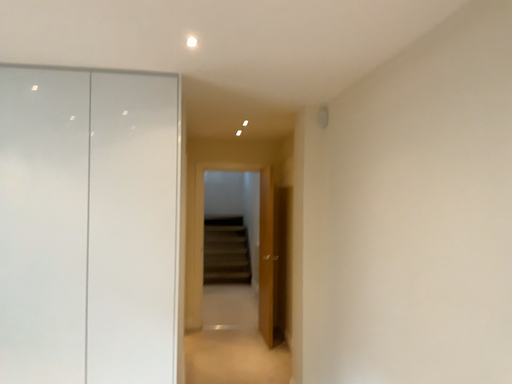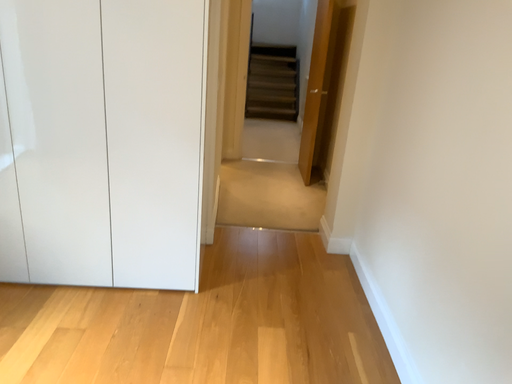
Question: How did the camera likely rotate when shooting the video?

Choices:
 (A) rotated left
 (B) rotated right

Answer: (A)